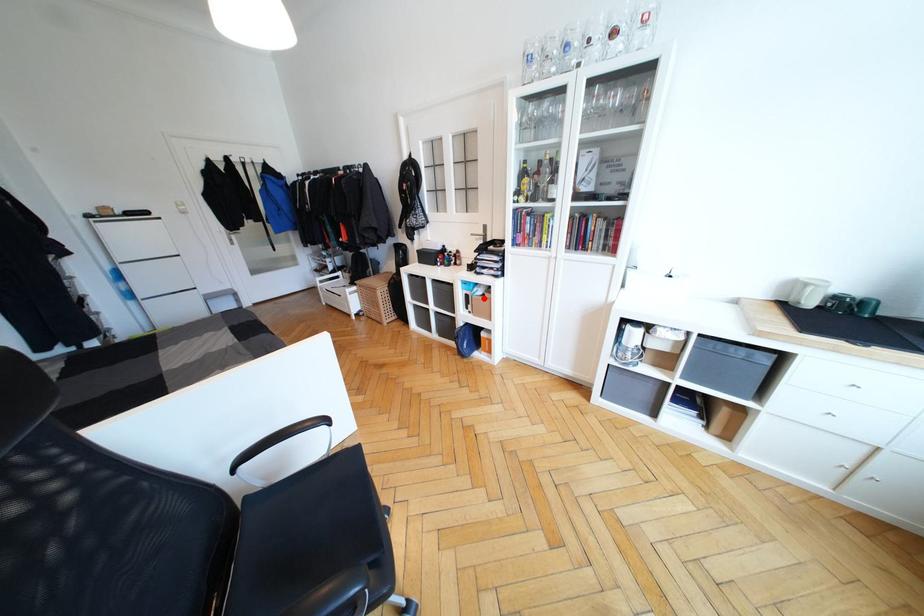
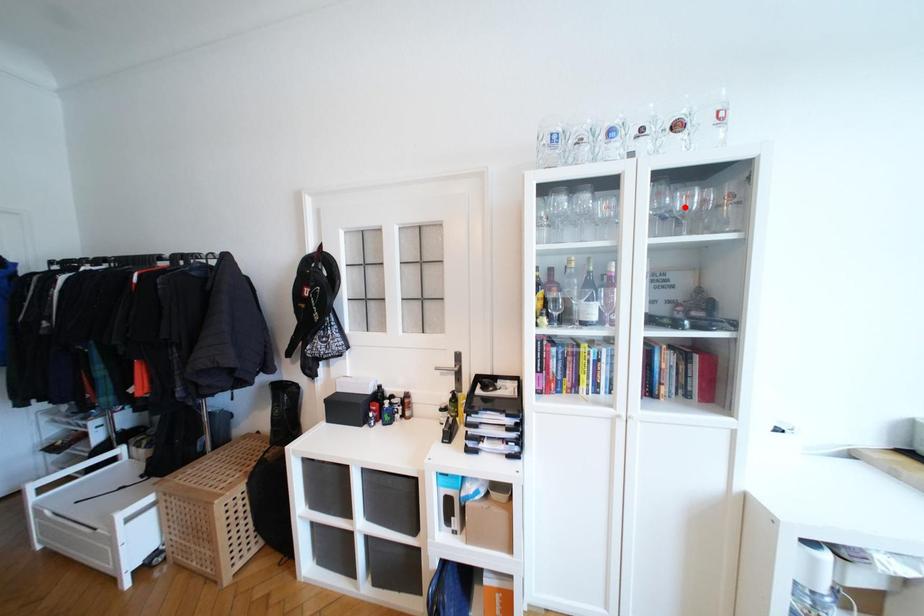
From the picture: I am providing you with two images of the same scene from different viewpoints. A red point is marked on the first image and another point is marked on the second image. Is the marked point in image1 the same physical position as the marked point in image2?

No